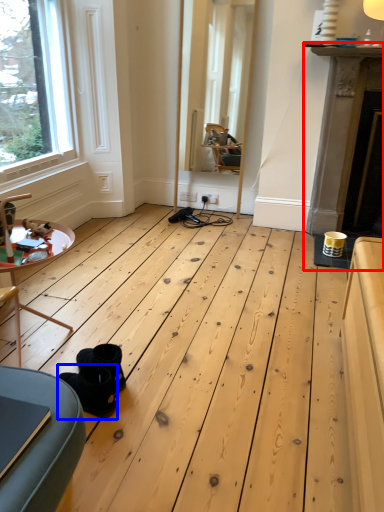
Question: Which point is further to the camera, fireplace (highlighted by a red box) or footwear (highlighted by a blue box)?

Choices:
 (A) fireplace
 (B) footwear

Answer: (A)